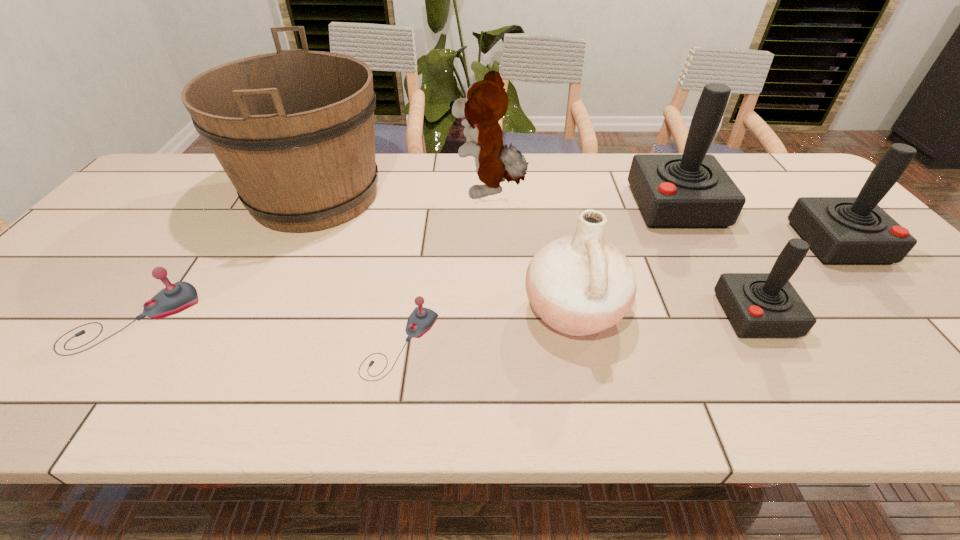
Find the location of a particular element. The image size is (960, 540). unoccupied area between the third shortest object and the rightmost red joystick is located at coordinates (796, 279).

At what (x,y) coordinates should I click in order to perform the action: click on empty space that is in between the tallest joystick and the bucket. Please return your answer as a coordinate pair (x, y). This screenshot has height=540, width=960. Looking at the image, I should click on (495, 201).

This screenshot has height=540, width=960. I want to click on free point between the rightmost object and the third tallest joystick, so click(x=796, y=279).

Locate an element on the screen. This screenshot has width=960, height=540. free point between the biggest red joystick and the third shortest object is located at coordinates (715, 260).

Image resolution: width=960 pixels, height=540 pixels. In order to click on free point between the puppy and the leftmost joystick in this screenshot , I will do `click(311, 255)`.

Locate an element on the screen. free area in between the tallest joystick and the third shortest joystick is located at coordinates (x=715, y=260).

Image resolution: width=960 pixels, height=540 pixels. I want to click on object that is the second closest to the fourth shortest joystick, so click(757, 304).

Locate which object is the fourth closest to the third tallest joystick. Please provide its 2D coordinates. Your answer should be formatted as a tuple, i.e. [(x, y)], where the tuple contains the x and y coordinates of a point satisfying the conditions above.

[(486, 102)]

Identify which joystick is the nearest to the leftmost joystick. Please provide its 2D coordinates. Your answer should be formatted as a tuple, i.e. [(x, y)], where the tuple contains the x and y coordinates of a point satisfying the conditions above.

[(421, 320)]

Identify which joystick is the fourth closest to the bucket. Please provide its 2D coordinates. Your answer should be formatted as a tuple, i.e. [(x, y)], where the tuple contains the x and y coordinates of a point satisfying the conditions above.

[(757, 304)]